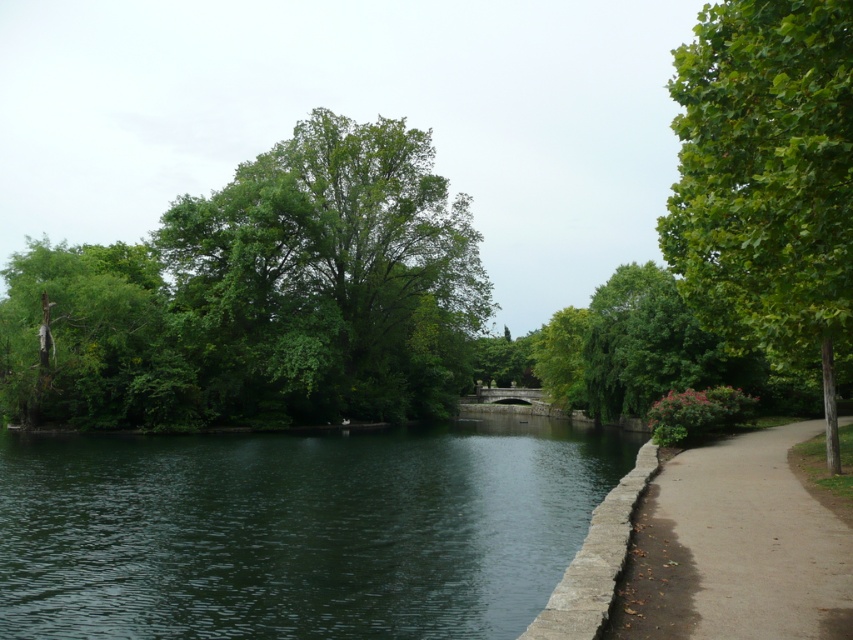
You are a park visitor who wants to take a photo of the dark green water at center and the green leafy tree at center. Can you stand at the pathway and capture both in a single frame without moving? Explain your reasoning.

The dark green water at center and green leafy tree at center are 59.16 feet apart from each other. Since the distance between them is relatively large, it might be challenging to capture both in a single frame without moving, depending on the camera lens used. However, using a wide angle lens could potentially include both in the shot.

You are standing on the paved pathway next to the dark green water at center. If you walk straight ahead along the pathway, will you eventually reach the bridge mentioned in the scene description?

Yes, because the pathway leads towards the bridge in the mid ground as described in the scene.